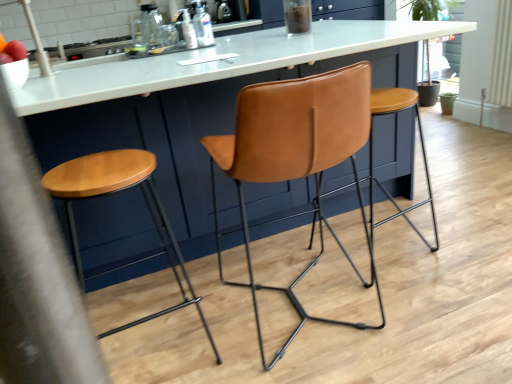
The image size is (512, 384). I want to click on free space to the back side of matte brown stool at center, which is the 2th stool in right-to-left order, so click(170, 283).